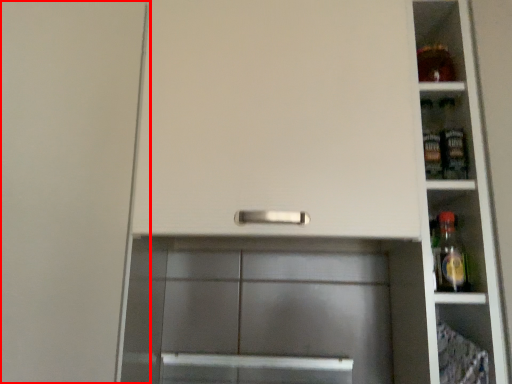
Question: Observing the image, what is the correct spatial positioning of door (annotated by the red box) in reference to shelf?

Choices:
 (A) right
 (B) left

Answer: (B)